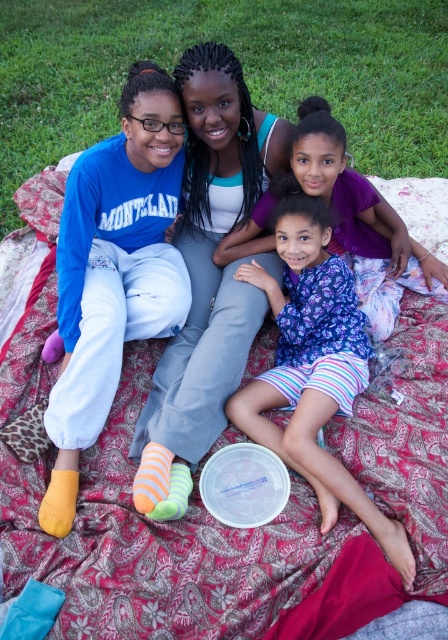
Question: Can you confirm if matte white tank top at center is positioned to the left of purple floral dress at center?

Choices:
 (A) yes
 (B) no

Answer: (A)

Question: Among these objects, which one is farthest from the camera?

Choices:
 (A) matte blue sweatshirt at left
 (B) purple floral dress at center

Answer: (B)

Question: Which object is farther from the camera taking this photo?

Choices:
 (A) matte white tank top at center
 (B) floral fabric dress at center

Answer: (A)

Question: Which of these objects is positioned farthest from the floral fabric dress at center?

Choices:
 (A) matte white tank top at center
 (B) purple floral dress at center

Answer: (B)

Question: Considering the relative positions of floral fabric dress at center and purple floral dress at center in the image provided, where is floral fabric dress at center located with respect to purple floral dress at center?

Choices:
 (A) above
 (B) below

Answer: (B)

Question: Can you confirm if green grass at upper center is bigger than floral fabric dress at center?

Choices:
 (A) yes
 (B) no

Answer: (A)